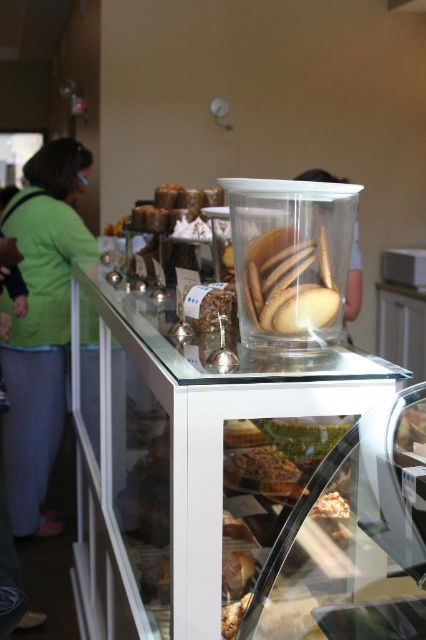
Question: Does crumbly brown pastry at center appear on the right side of golden brown flaky pastry at center?

Choices:
 (A) no
 (B) yes

Answer: (A)

Question: Is green fabric jacket at left below translucent plastic cookies at center?

Choices:
 (A) yes
 (B) no

Answer: (A)

Question: Which point is closer to the camera taking this photo?

Choices:
 (A) [x=302, y=241]
 (B) [x=143, y=218]
 (C) [x=259, y=461]

Answer: (A)

Question: Observing the image, what is the correct spatial positioning of crumbly brown pastry at center in reference to golden brown flaky pastry at center?

Choices:
 (A) right
 (B) left

Answer: (B)

Question: Which point appears closest to the camera in this image?

Choices:
 (A) (360, 288)
 (B) (334, 493)

Answer: (B)

Question: Which of the following is the farthest from the observer?

Choices:
 (A) (212, 195)
 (B) (31, 314)

Answer: (B)